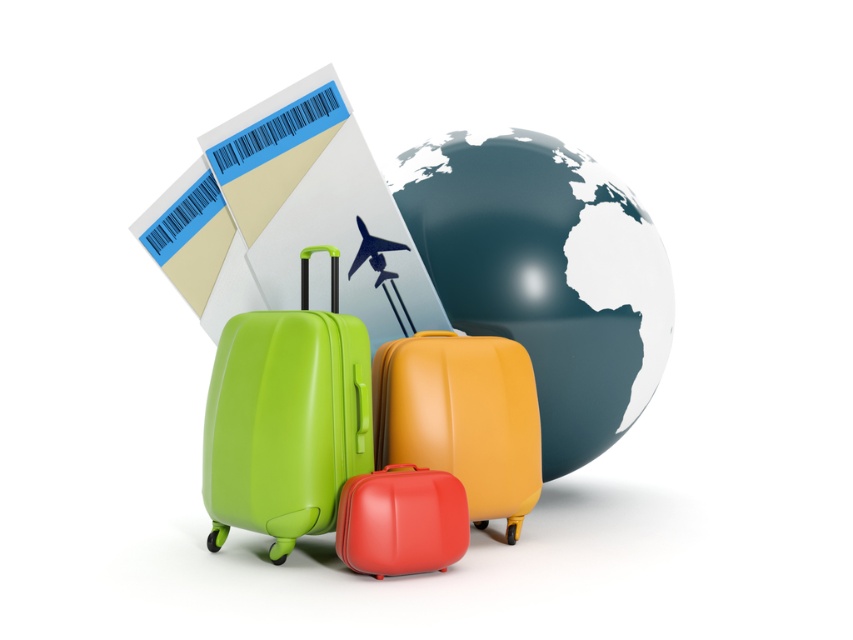
Can you confirm if shiny metallic globe at center is bigger than green matte suitcase at center?

Yes, shiny metallic globe at center is bigger than green matte suitcase at center.

Who is lower down, shiny metallic globe at center or green matte suitcase at center?

Positioned lower is green matte suitcase at center.

Is point (614, 250) farther from viewer compared to point (306, 371)?

Yes, it is behind point (306, 371).

This screenshot has width=853, height=640. Identify the location of shiny metallic globe at center. (546, 275).

Who is higher up, green matte suitcase at center or matte orange suitcase at center?

green matte suitcase at center is above.

Which is more to the left, green matte suitcase at center or matte orange suitcase at center?

Positioned to the left is green matte suitcase at center.

Identify the location of green matte suitcase at center. This screenshot has height=640, width=853. (285, 419).

Is shiny metallic globe at center in front of matte orange suitcase at center?

No, shiny metallic globe at center is further to the viewer.

Can you confirm if shiny metallic globe at center is positioned above matte orange suitcase at center?

Correct, shiny metallic globe at center is located above matte orange suitcase at center.

The width and height of the screenshot is (853, 640). I want to click on shiny metallic globe at center, so click(546, 275).